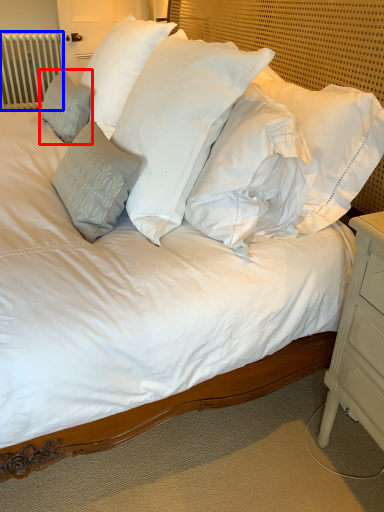
Question: Which of the following is the closest to the observer, pillow (highlighted by a red box) or radiator (highlighted by a blue box)?

Choices:
 (A) pillow
 (B) radiator

Answer: (A)